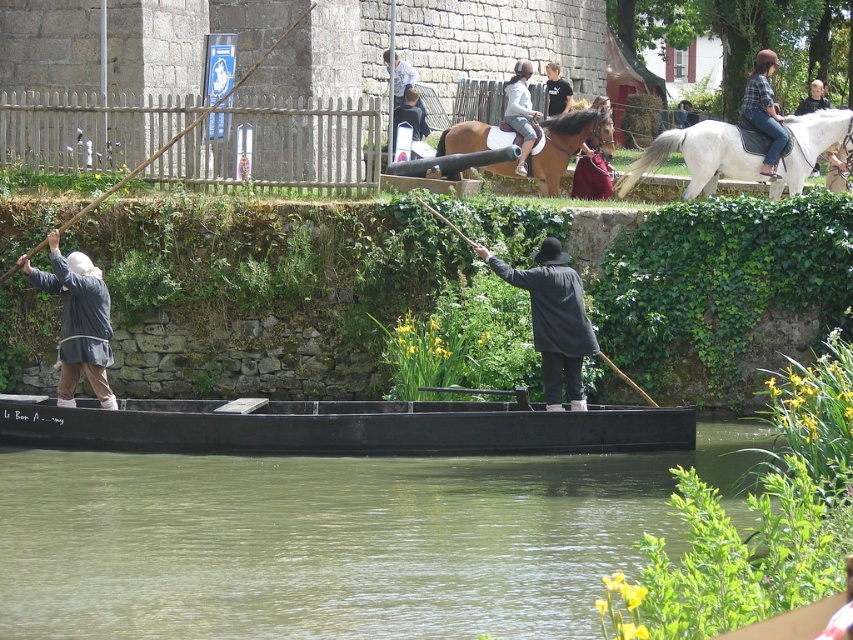
Question: Does green water at lower center appear on the left side of brown glossy horse at center?

Choices:
 (A) no
 (B) yes

Answer: (B)

Question: Can you confirm if black matte canoe at center is positioned above white glossy horse at upper right?

Choices:
 (A) yes
 (B) no

Answer: (B)

Question: Can you confirm if white glossy horse at upper right is smaller than denim jacket at upper right?

Choices:
 (A) no
 (B) yes

Answer: (B)

Question: Which point appears closest to the camera in this image?

Choices:
 (A) (572, 97)
 (B) (358, 442)

Answer: (B)

Question: Estimate the real-world distances between objects in this image. Which object is closer to the wooden stick at left?

Choices:
 (A) dark blue leather jacket at upper center
 (B) white glossy horse at upper right
 (C) brown glossy horse at center
 (D) black matte canoe at center

Answer: (D)

Question: Estimate the real-world distances between objects in this image. Which object is closer to the brown glossy horse at center?

Choices:
 (A) black cotton shirt at upper center
 (B) white glossy horse at upper right

Answer: (B)